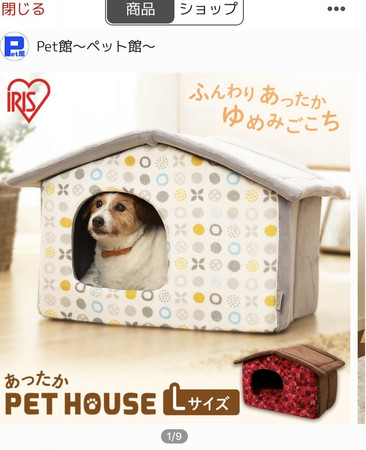
This screenshot has height=450, width=366. Find the location of `wall`. wall is located at coordinates (200, 117), (160, 105).